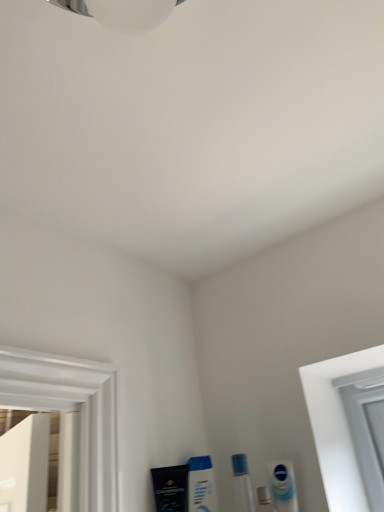
Identify the location of black matte tube at lower left, positioned as the fourth mouthwash in right-to-left order. (171, 488).

In order to face white glossy tube at lower right, which is the fourth mouthwash from left to right, should I rotate leftwards or rightwards?

You should look right and rotate roughly 12.014 degrees.

The image size is (384, 512). What do you see at coordinates (264, 500) in the screenshot?
I see `silver metallic mouthwash at lower center, placed as the 3th mouthwash when sorted from left to right` at bounding box center [264, 500].

Locate an element on the screen. The width and height of the screenshot is (384, 512). white glossy mouthwash at lower center, the second mouthwash in the left-to-right sequence is located at coordinates (201, 485).

Is black matte tube at lower left, positioned as the fourth mouthwash in right-to-left order, wider or thinner than silver metallic mouthwash at lower center, placed as the 3th mouthwash when sorted from left to right?

Considering their sizes, black matte tube at lower left, positioned as the fourth mouthwash in right-to-left order, looks broader than silver metallic mouthwash at lower center, placed as the 3th mouthwash when sorted from left to right.

Consider the image. Is black matte tube at lower left, acting as the first mouthwash starting from the left, oriented away from silver metallic mouthwash at lower center, placed as the 3th mouthwash when sorted from left to right?

That's not correct — black matte tube at lower left, acting as the first mouthwash starting from the left, is not looking away from silver metallic mouthwash at lower center, placed as the 3th mouthwash when sorted from left to right.

From their relative heights in the image, would you say black matte tube at lower left, acting as the first mouthwash starting from the left, is taller or shorter than silver metallic mouthwash at lower center, placed as the 3th mouthwash when sorted from left to right?

black matte tube at lower left, acting as the first mouthwash starting from the left, is taller than silver metallic mouthwash at lower center, placed as the 3th mouthwash when sorted from left to right.

What's the angular difference between black matte tube at lower left, positioned as the fourth mouthwash in right-to-left order, and silver metallic mouthwash at lower center, placed as the 3th mouthwash when sorted from left to right,'s facing directions?

The angular difference between black matte tube at lower left, positioned as the fourth mouthwash in right-to-left order, and silver metallic mouthwash at lower center, placed as the 3th mouthwash when sorted from left to right, is 28.4 degrees.

Is white glossy tube at lower right, which is the first mouthwash in right-to-left order, to the left or to the right of transparent plastic vial at lower center in the image?

From the image, it's evident that white glossy tube at lower right, which is the first mouthwash in right-to-left order, is to the right of transparent plastic vial at lower center.

Choose the correct answer: Is white glossy tube at lower right, which is the fourth mouthwash from left to right, inside transparent plastic vial at lower center or outside it?

white glossy tube at lower right, which is the fourth mouthwash from left to right, is located beyond the bounds of transparent plastic vial at lower center.

How much distance is there between white glossy tube at lower right, which is the fourth mouthwash from left to right, and transparent plastic vial at lower center?

The distance of white glossy tube at lower right, which is the fourth mouthwash from left to right, from transparent plastic vial at lower center is 3.14 inches.

Considering the relative sizes of white glossy tube at lower right, which is the fourth mouthwash from left to right, and transparent plastic vial at lower center in the image provided, is white glossy tube at lower right, which is the fourth mouthwash from left to right, thinner than transparent plastic vial at lower center?

Correct, the width of white glossy tube at lower right, which is the fourth mouthwash from left to right, is less than that of transparent plastic vial at lower center.

From the image's perspective, is silver metallic mouthwash at lower center, placed as the 3th mouthwash when sorted from left to right, located above or below transparent plastic vial at lower center?

Clearly, from the image's perspective, silver metallic mouthwash at lower center, placed as the 3th mouthwash when sorted from left to right, is below transparent plastic vial at lower center.

How different are the orientations of silver metallic mouthwash at lower center, the second mouthwash viewed from the right, and transparent plastic vial at lower center in degrees?

The facing directions of silver metallic mouthwash at lower center, the second mouthwash viewed from the right, and transparent plastic vial at lower center are 0 degrees apart.

Is silver metallic mouthwash at lower center, placed as the 3th mouthwash when sorted from left to right, at the right side of transparent plastic vial at lower center?

Yes, silver metallic mouthwash at lower center, placed as the 3th mouthwash when sorted from left to right, is to the right of transparent plastic vial at lower center.

Is point (268, 502) farther from camera compared to point (248, 494)?

That is False.

Relative to white glossy tube at lower right, which is the first mouthwash in right-to-left order, is silver metallic mouthwash at lower center, the second mouthwash viewed from the right, in front or behind?

Clearly, silver metallic mouthwash at lower center, the second mouthwash viewed from the right, is in front of white glossy tube at lower right, which is the first mouthwash in right-to-left order.

From the image's perspective, between silver metallic mouthwash at lower center, the second mouthwash viewed from the right, and white glossy tube at lower right, which is the first mouthwash in right-to-left order, which one is located above?

white glossy tube at lower right, which is the first mouthwash in right-to-left order, appears higher in the image.

Is silver metallic mouthwash at lower center, the second mouthwash viewed from the right, in contact with white glossy tube at lower right, which is the first mouthwash in right-to-left order?

Yes, silver metallic mouthwash at lower center, the second mouthwash viewed from the right, is beside white glossy tube at lower right, which is the first mouthwash in right-to-left order.

Which of these two, silver metallic mouthwash at lower center, the second mouthwash viewed from the right, or white glossy tube at lower right, which is the fourth mouthwash from left to right, stands taller?

white glossy tube at lower right, which is the fourth mouthwash from left to right, is taller.

Is transparent plastic vial at lower center shorter than white glossy tube at lower right, which is the first mouthwash in right-to-left order?

No, transparent plastic vial at lower center is not shorter than white glossy tube at lower right, which is the first mouthwash in right-to-left order.

Considering the positions of point (239, 462) and point (277, 504), is point (239, 462) closer or farther from the camera than point (277, 504)?

Clearly, point (239, 462) is more distant from the camera than point (277, 504).

Would you say transparent plastic vial at lower center is inside or outside white glossy tube at lower right, which is the fourth mouthwash from left to right?

transparent plastic vial at lower center cannot be found inside white glossy tube at lower right, which is the fourth mouthwash from left to right.

Could you tell me if transparent plastic vial at lower center is turned towards white glossy tube at lower right, which is the fourth mouthwash from left to right?

No, transparent plastic vial at lower center is not oriented towards white glossy tube at lower right, which is the fourth mouthwash from left to right.

Is silver metallic mouthwash at lower center, placed as the 3th mouthwash when sorted from left to right, surrounding white glossy mouthwash at lower center, the third mouthwash viewed from the right?

No, white glossy mouthwash at lower center, the third mouthwash viewed from the right, is not inside silver metallic mouthwash at lower center, placed as the 3th mouthwash when sorted from left to right.

From a real-world perspective, is silver metallic mouthwash at lower center, the second mouthwash viewed from the right, on white glossy mouthwash at lower center, the second mouthwash in the left-to-right sequence?

No, from a real-world perspective, silver metallic mouthwash at lower center, the second mouthwash viewed from the right, is not over white glossy mouthwash at lower center, the second mouthwash in the left-to-right sequence

Looking at the image, does black matte tube at lower left, acting as the first mouthwash starting from the left, seem bigger or smaller compared to transparent plastic vial at lower center?

Clearly, black matte tube at lower left, acting as the first mouthwash starting from the left, is larger in size than transparent plastic vial at lower center.

Between black matte tube at lower left, acting as the first mouthwash starting from the left, and transparent plastic vial at lower center, which one appears on the right side from the viewer's perspective?

Positioned to the right is transparent plastic vial at lower center.

In the scene shown: Could you tell me if black matte tube at lower left, acting as the first mouthwash starting from the left, is facing transparent plastic vial at lower center?

No, black matte tube at lower left, acting as the first mouthwash starting from the left, is not facing towards transparent plastic vial at lower center.

Who is more distant, black matte tube at lower left, acting as the first mouthwash starting from the left, or transparent plastic vial at lower center?

black matte tube at lower left, acting as the first mouthwash starting from the left, is further from the camera.

Where is `the 1st mouthwash behind the black matte tube at lower left, positioned as the fourth mouthwash in right-to-left order, counting from the anchor's position`? The image size is (384, 512). the 1st mouthwash behind the black matte tube at lower left, positioned as the fourth mouthwash in right-to-left order, counting from the anchor's position is located at coordinates (264, 500).

Find the location of a particular element. Image resolution: width=384 pixels, height=512 pixels. mouthwash that is the 1st object directly below the transparent plastic vial at lower center (from a real-world perspective) is located at coordinates (283, 485).

Consider the image. When comparing their distances from white glossy tube at lower right, which is the first mouthwash in right-to-left order, does black matte tube at lower left, positioned as the fourth mouthwash in right-to-left order, or transparent plastic vial at lower center seem further?

The object further to white glossy tube at lower right, which is the first mouthwash in right-to-left order, is black matte tube at lower left, positioned as the fourth mouthwash in right-to-left order.

Which object lies further to the anchor point white glossy mouthwash at lower center, the second mouthwash in the left-to-right sequence, black matte tube at lower left, positioned as the fourth mouthwash in right-to-left order, or white glossy tube at lower right, which is the fourth mouthwash from left to right?

white glossy tube at lower right, which is the fourth mouthwash from left to right, is positioned further to the anchor white glossy mouthwash at lower center, the second mouthwash in the left-to-right sequence.

From the image, which object appears to be nearer to white glossy mouthwash at lower center, the third mouthwash viewed from the right, silver metallic mouthwash at lower center, placed as the 3th mouthwash when sorted from left to right, or black matte tube at lower left, positioned as the fourth mouthwash in right-to-left order?

black matte tube at lower left, positioned as the fourth mouthwash in right-to-left order.

Based on their spatial positions, is silver metallic mouthwash at lower center, placed as the 3th mouthwash when sorted from left to right, or white glossy mouthwash at lower center, the third mouthwash viewed from the right, closer to white glossy tube at lower right, which is the first mouthwash in right-to-left order?

silver metallic mouthwash at lower center, placed as the 3th mouthwash when sorted from left to right.

When comparing their distances from white glossy mouthwash at lower center, the second mouthwash in the left-to-right sequence, does black matte tube at lower left, positioned as the fourth mouthwash in right-to-left order, or transparent plastic vial at lower center seem closer?

black matte tube at lower left, positioned as the fourth mouthwash in right-to-left order, is positioned closer to the anchor white glossy mouthwash at lower center, the second mouthwash in the left-to-right sequence.

Looking at the image, which one is located closer to white glossy mouthwash at lower center, the third mouthwash viewed from the right, silver metallic mouthwash at lower center, placed as the 3th mouthwash when sorted from left to right, or transparent plastic vial at lower center?

The object closer to white glossy mouthwash at lower center, the third mouthwash viewed from the right, is transparent plastic vial at lower center.

Which object lies nearer to the anchor point white glossy mouthwash at lower center, the second mouthwash in the left-to-right sequence, white glossy tube at lower right, which is the fourth mouthwash from left to right, or silver metallic mouthwash at lower center, placed as the 3th mouthwash when sorted from left to right?

Among the two, silver metallic mouthwash at lower center, placed as the 3th mouthwash when sorted from left to right, is located nearer to white glossy mouthwash at lower center, the second mouthwash in the left-to-right sequence.

When comparing their distances from white glossy tube at lower right, which is the fourth mouthwash from left to right, does transparent plastic vial at lower center or silver metallic mouthwash at lower center, the second mouthwash viewed from the right, seem closer?

Among the two, silver metallic mouthwash at lower center, the second mouthwash viewed from the right, is located nearer to white glossy tube at lower right, which is the fourth mouthwash from left to right.

Find the location of a particular element. This screenshot has height=512, width=384. toiletry between black matte tube at lower left, acting as the first mouthwash starting from the left, and white glossy tube at lower right, which is the fourth mouthwash from left to right is located at coordinates (242, 484).

Where is `toiletry situated between white glossy mouthwash at lower center, the third mouthwash viewed from the right, and white glossy tube at lower right, which is the first mouthwash in right-to-left order, from left to right`? toiletry situated between white glossy mouthwash at lower center, the third mouthwash viewed from the right, and white glossy tube at lower right, which is the first mouthwash in right-to-left order, from left to right is located at coordinates (242, 484).

At what (x,y) coordinates should I click in order to perform the action: click on toiletry between black matte tube at lower left, acting as the first mouthwash starting from the left, and silver metallic mouthwash at lower center, placed as the 3th mouthwash when sorted from left to right, in the horizontal direction. Please return your answer as a coordinate pair (x, y). Looking at the image, I should click on (242, 484).

Where is `mouthwash between black matte tube at lower left, acting as the first mouthwash starting from the left, and silver metallic mouthwash at lower center, the second mouthwash viewed from the right, in the horizontal direction`? Image resolution: width=384 pixels, height=512 pixels. mouthwash between black matte tube at lower left, acting as the first mouthwash starting from the left, and silver metallic mouthwash at lower center, the second mouthwash viewed from the right, in the horizontal direction is located at coordinates (201, 485).